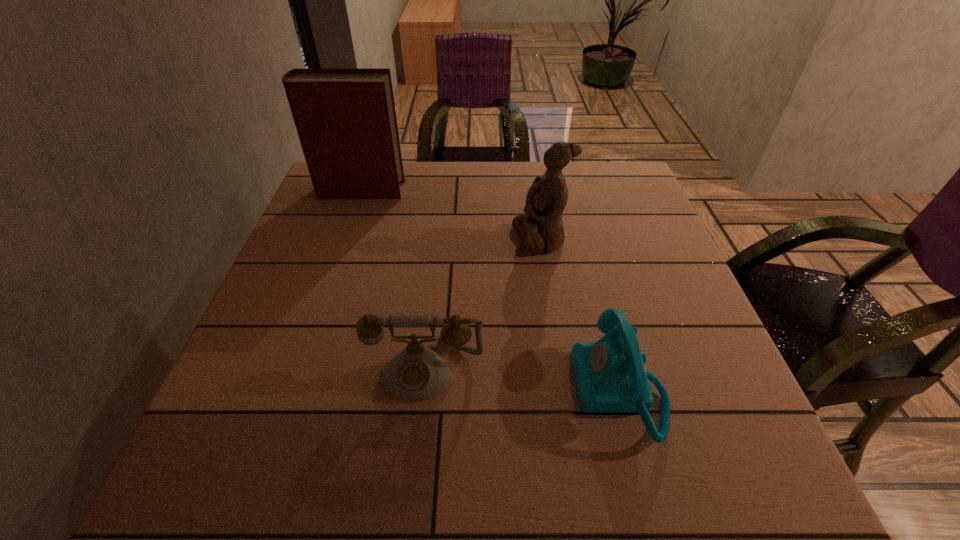
Locate an element on the screen. Image resolution: width=960 pixels, height=540 pixels. the leftmost object is located at coordinates (345, 118).

Image resolution: width=960 pixels, height=540 pixels. I want to click on the tallest object, so click(345, 118).

Find the location of a particular element. the second farthest object is located at coordinates (541, 229).

Find the location of a particular element. This screenshot has height=540, width=960. figurine is located at coordinates (541, 229).

This screenshot has height=540, width=960. I want to click on the second object from left to right, so click(416, 373).

Identify the location of the right telephone. (610, 377).

Locate an element on the screen. free space located 0.390m on the open cover of the hardback book is located at coordinates (546, 191).

Locate an element on the screen. The image size is (960, 540). vacant area situated 0.290m on the front-facing side of the third nearest object is located at coordinates (391, 239).

This screenshot has height=540, width=960. I want to click on vacant region located on the front-facing side of the third nearest object, so click(x=391, y=239).

I want to click on free space located 0.220m on the front-facing side of the third nearest object, so click(x=420, y=239).